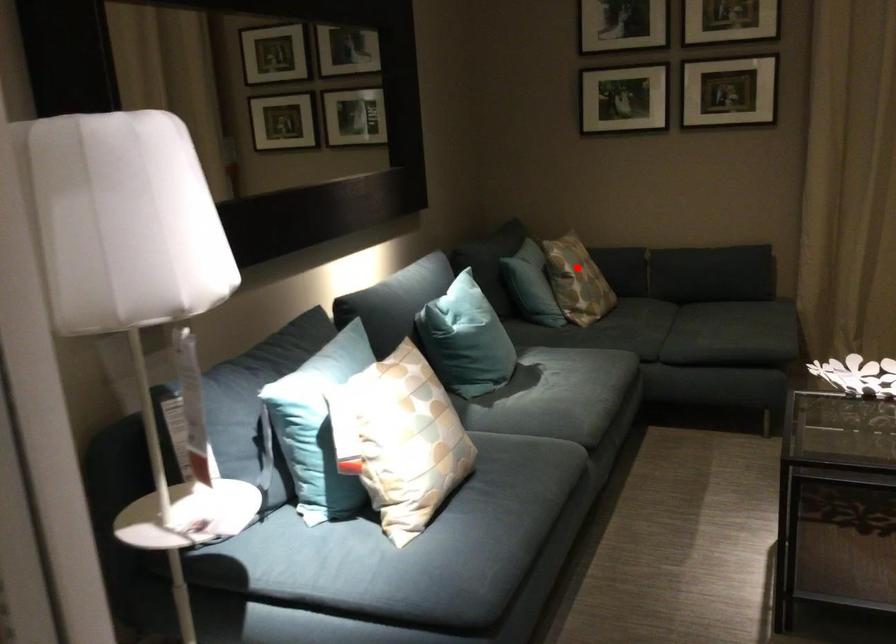
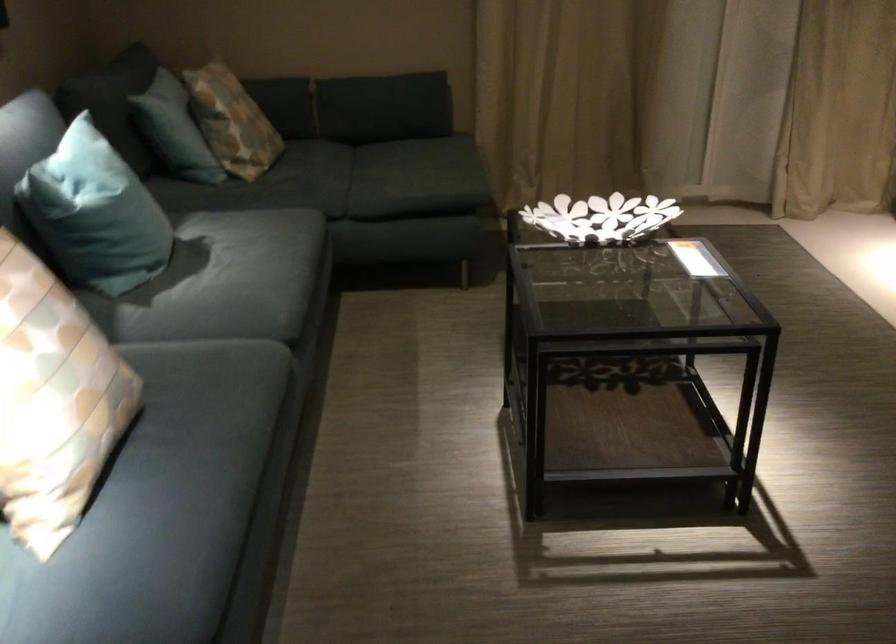
Question: A red point is marked in image1. In image2, is the corresponding 3D point closer to the camera or farther? Reply with the corresponding letter.

Choices:
 (A) The corresponding 3D point is closer.
 (B) The corresponding 3D point is farther.

Answer: (A)